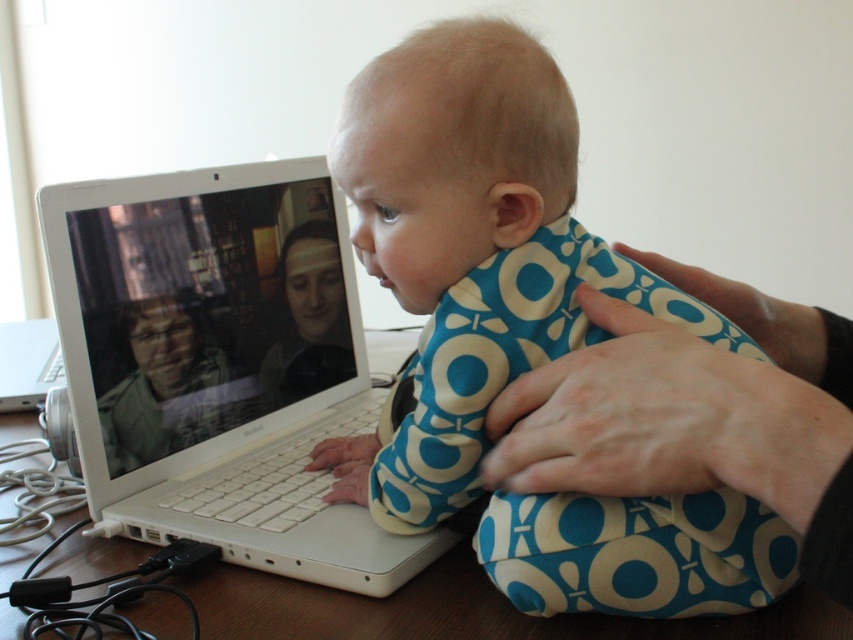
You are a photographer trying to capture a closeup shot of the baby in the blue printed onesie at center. There is a blue printed fabric at center in the way. Can you tell me which one is wider so I know which to move?

The blue printed onesie at center might be wider than blue printed fabric at center, so you should move the blue printed fabric at center to get a clear shot of the baby.

You are a delivery robot with a package that needs to be placed between the blue printed fabric at center and the green matte jacket at center. The package measures 16 inches in length. Will it fit in the space between them?

The distance between the blue printed fabric at center and the green matte jacket at center is 15.31 inches. Since the package is 16 inches long, it will not fit in the space between them.

You are a photographer taking a picture of the baby in the blue printed onesie at center and the blue printed fabric at center. Which item should you focus on to ensure the subject is in the foreground?

The blue printed onesie at center should be focused on because it has a larger size compared to the blue printed fabric at center, making it the primary subject in the foreground.